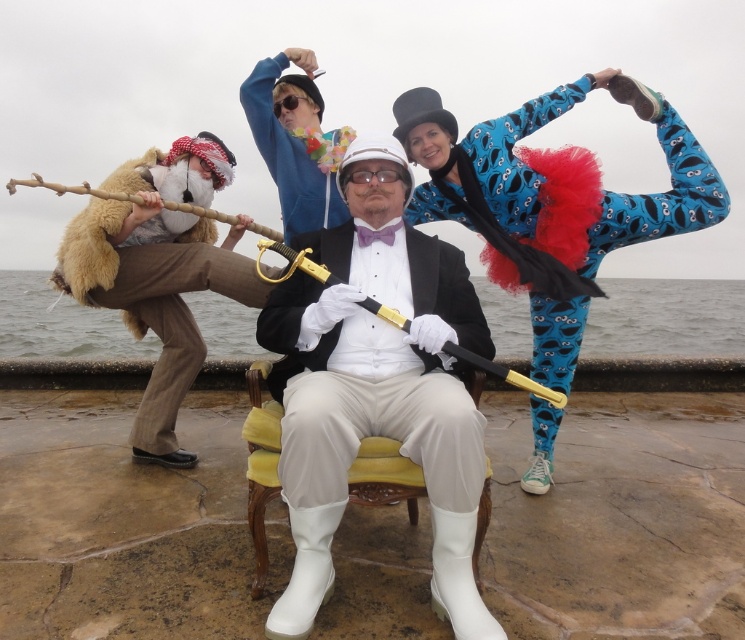
Which is in front, point (484, 209) or point (291, 88)?

Point (484, 209) is in front.

Who is more distant from viewer, (x=533, y=291) or (x=291, y=221)?

Positioned behind is point (x=291, y=221).

You are a GUI agent. You are given a task and a screenshot of the screen. Output one action in this format:
    pyautogui.click(x=<x>, y=<y>)
    Task: Click on the blue spandex tights at upper right
    The height and width of the screenshot is (640, 745).
    Given the screenshot: What is the action you would take?
    pyautogui.click(x=548, y=205)

Which is more to the left, blue hoodie at upper center or yellow fabric chair at center?

From the viewer's perspective, blue hoodie at upper center appears more on the left side.

This screenshot has width=745, height=640. Identify the location of blue hoodie at upper center. (297, 140).

Where is `blue hoodie at upper center`? The image size is (745, 640). blue hoodie at upper center is located at coordinates (297, 140).

Is point (408, 445) positioned before point (536, 406)?

Yes, it is.

Between matte black suit at center and blue spandex tights at upper right, which one has more height?

blue spandex tights at upper right is taller.

In order to click on matte black suit at center in this screenshot , I will do `click(378, 387)`.

This screenshot has width=745, height=640. Identify the location of matte black suit at center. (378, 387).